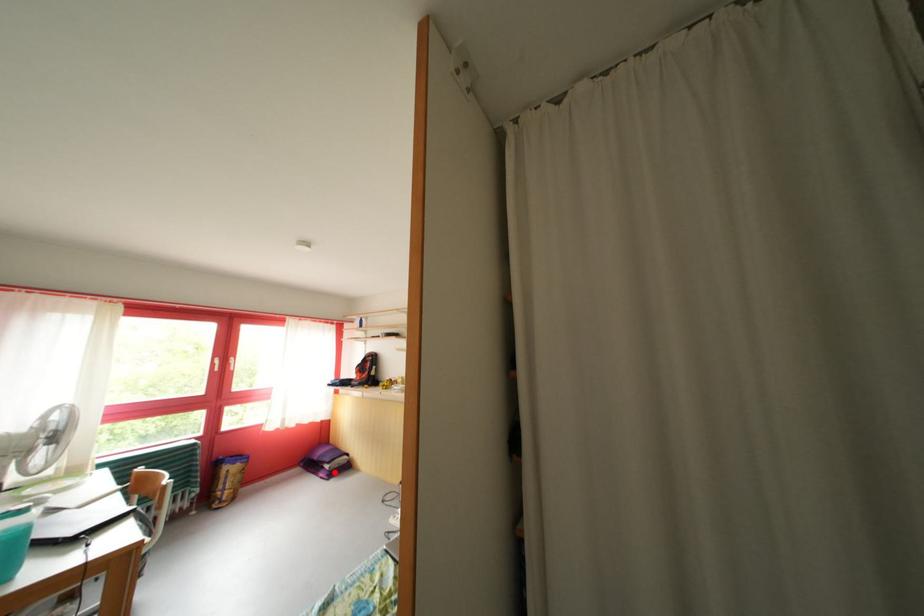
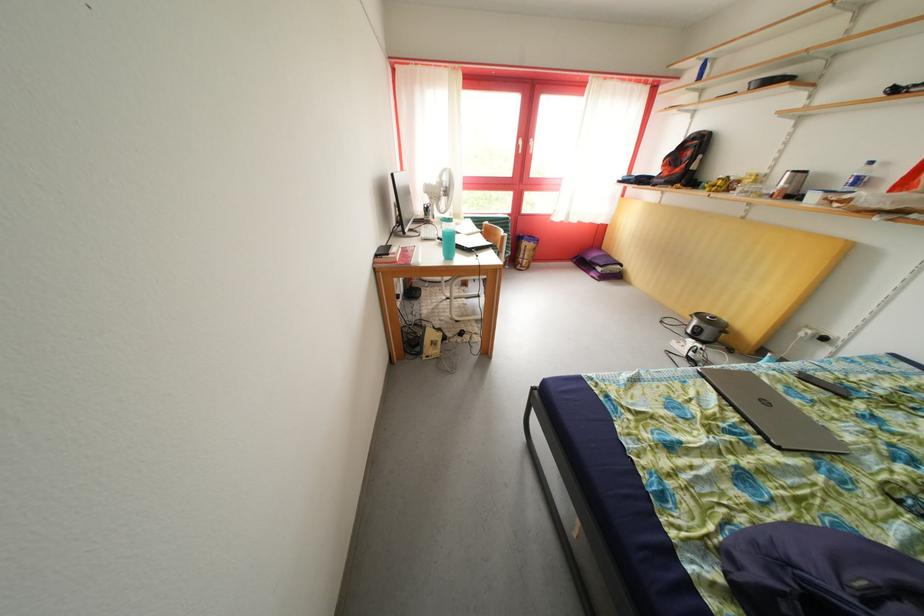
Question: I am providing you with two images of the same scene from different viewpoints. In image1, a red point is highlighted. Considering the same 3D point in image2, which of the following is correct?

Choices:
 (A) It is closer
 (B) It is farther

Answer: (A)